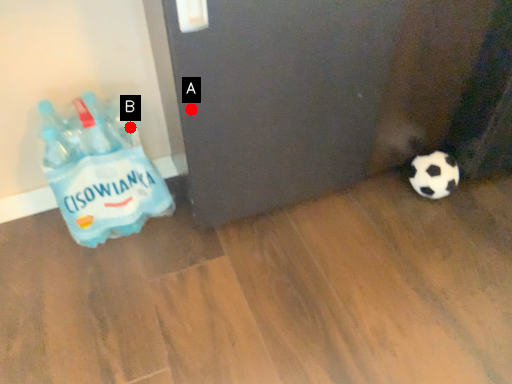
Question: Two points are circled on the image, labeled by A and B beside each circle. Which point is closer to the camera taking this photo?

Choices:
 (A) A is closer
 (B) B is closer

Answer: (A)